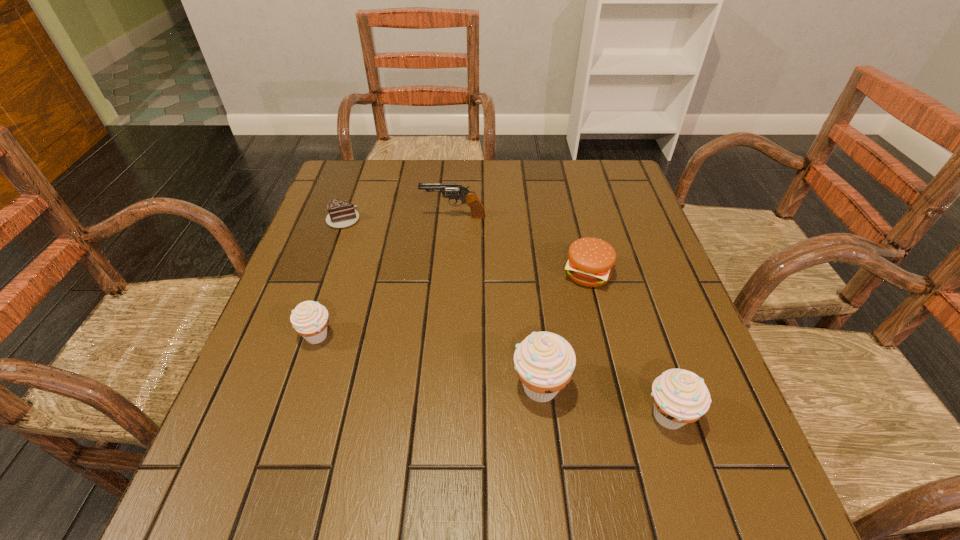
Identify the location of vacant space located 0.290m on the left of the tallest muffin. (357, 387).

I want to click on free space located on the back of the second tallest muffin, so click(x=638, y=323).

The image size is (960, 540). I want to click on free space located 0.170m on the front of the fourth nearest object, so click(608, 354).

The image size is (960, 540). I want to click on vacant space located 0.110m on the right of the chocolate cake, so click(400, 218).

What are the coordinates of `free space located 0.210m along the barrel of the gun` in the screenshot? It's located at (345, 217).

What are the coordinates of `free space located 0.130m along the barrel of the gun` in the screenshot? It's located at (373, 217).

Find the location of `free space located along the barrel of the gun`. free space located along the barrel of the gun is located at coordinates (393, 217).

At what (x,y) coordinates should I click in order to perform the action: click on muffin present at the left edge. Please return your answer as a coordinate pair (x, y). The image size is (960, 540). Looking at the image, I should click on (309, 319).

Locate an element on the screen. This screenshot has height=540, width=960. chocolate cake that is at the left edge is located at coordinates (342, 214).

Where is `muffin situated at the right edge`? muffin situated at the right edge is located at coordinates (680, 396).